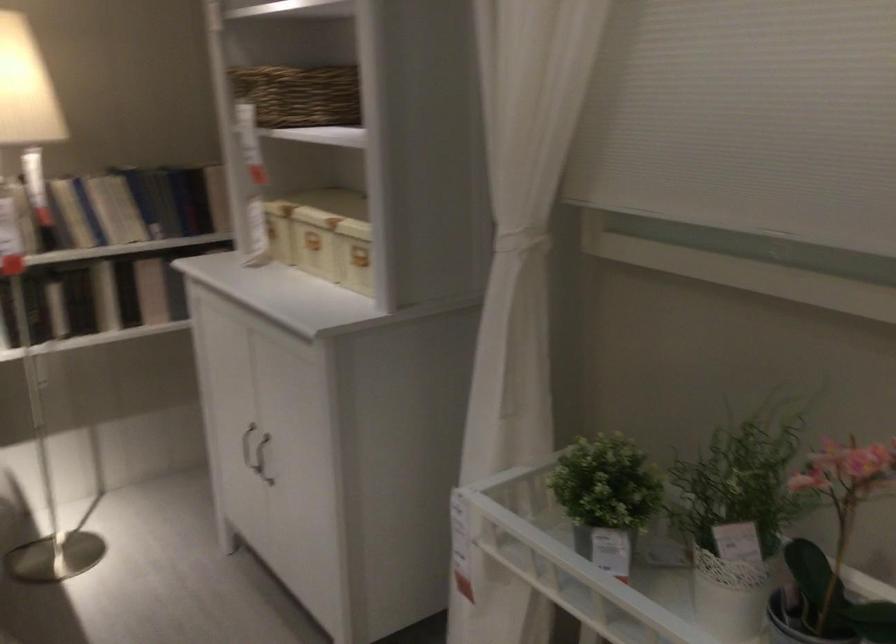
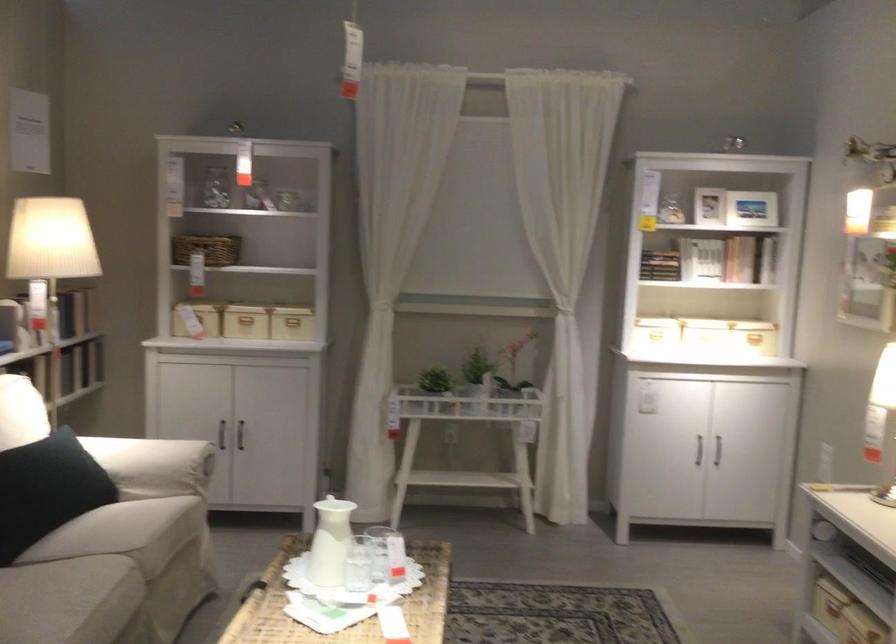
In the second image, find the point that corresponds to point 314,245 in the first image.

(245, 319)